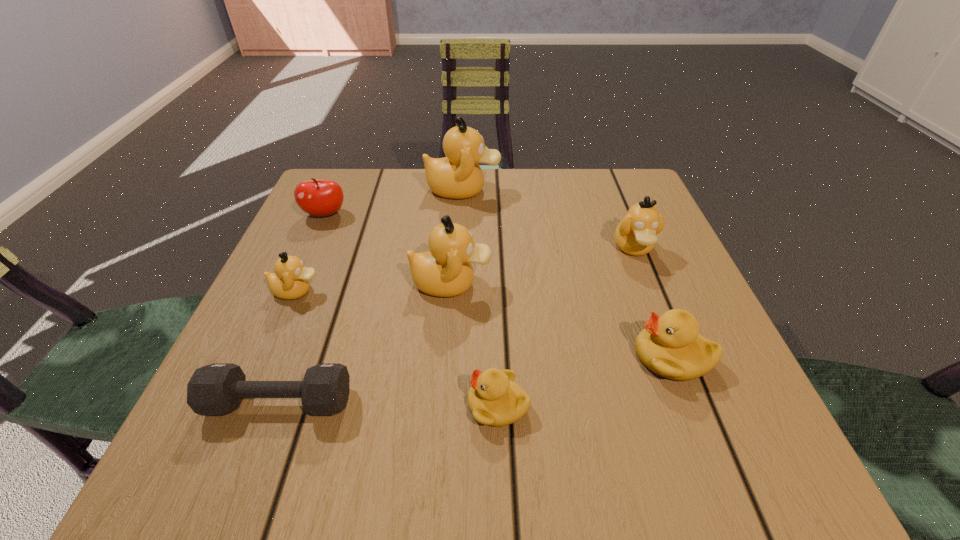
Image resolution: width=960 pixels, height=540 pixels. What are the coordinates of `duckling located at the left edge` in the screenshot? It's located at (290, 281).

Where is `dumbbell situated at the left edge`? dumbbell situated at the left edge is located at coordinates click(x=214, y=390).

Locate an element on the screen. object present at the far left corner is located at coordinates (x=315, y=197).

Locate an element on the screen. object present at the near left corner is located at coordinates (214, 390).

Where is `vacant space at the far edge of the desktop`? Image resolution: width=960 pixels, height=540 pixels. vacant space at the far edge of the desktop is located at coordinates (470, 219).

Identify the location of free region at the near edge. (342, 456).

What are the coordinates of `free space at the left edge of the desktop` in the screenshot? It's located at (278, 322).

At what (x,y) coordinates should I click in order to perform the action: click on vacant point at the right edge. Please return your answer as a coordinate pair (x, y). The height and width of the screenshot is (540, 960). Looking at the image, I should click on (636, 321).

At what (x,y) coordinates should I click in order to perform the action: click on free region at the far left corner. Please return your answer as a coordinate pair (x, y). Looking at the image, I should click on (372, 181).

You are a GUI agent. You are given a task and a screenshot of the screen. Output one action in this format:
    pyautogui.click(x=<x>, y=<y>)
    Task: Click on the free location at the far right corner of the desktop
    
    Given the screenshot: What is the action you would take?
    pyautogui.click(x=642, y=190)